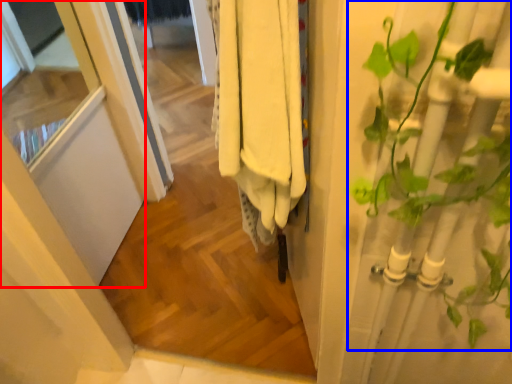
Question: Which object is closer to the camera taking this photo, screen door (highlighted by a red box) or houseplant (highlighted by a blue box)?

Choices:
 (A) screen door
 (B) houseplant

Answer: (B)